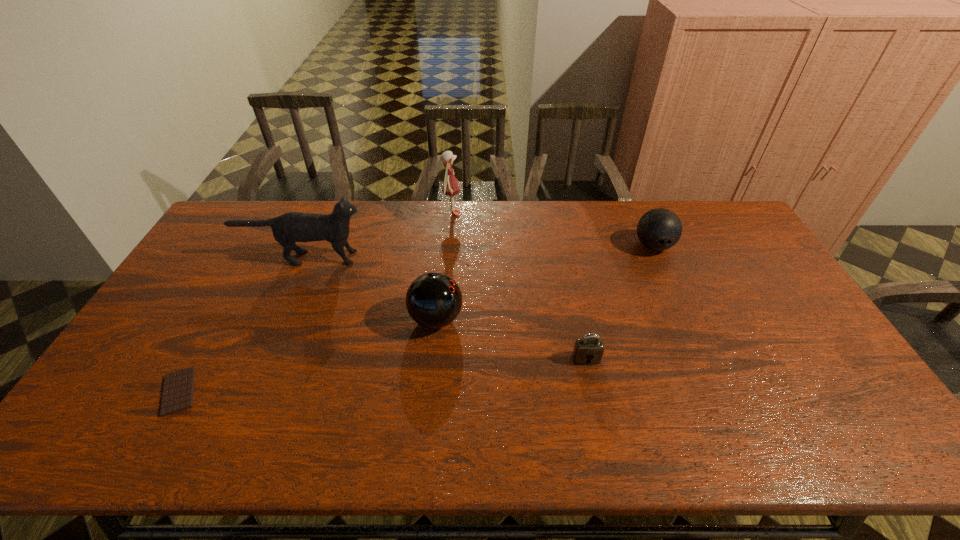
Where is `vacant space at the far edge of the desktop`? The height and width of the screenshot is (540, 960). vacant space at the far edge of the desktop is located at coordinates (502, 207).

Locate an element on the screen. This screenshot has width=960, height=540. free region at the near edge of the desktop is located at coordinates (245, 425).

The width and height of the screenshot is (960, 540). In the image, there is a desktop. Find the location of `vacant region at the left edge`. vacant region at the left edge is located at coordinates (180, 330).

What are the coordinates of `vacant space at the far left corner of the desktop` in the screenshot? It's located at (246, 209).

In the image, there is a desktop. What are the coordinates of `vacant space at the near left corner` in the screenshot? It's located at (87, 427).

Where is `free space between the doll and the shortest object`? The height and width of the screenshot is (540, 960). free space between the doll and the shortest object is located at coordinates pos(316,302).

You are a GUI agent. You are given a task and a screenshot of the screen. Output one action in this format:
    pyautogui.click(x=<x>, y=<y>)
    Task: Click on the vacant point located between the second object from right to left and the third nearest object
    Image resolution: width=960 pixels, height=540 pixels.
    Given the screenshot: What is the action you would take?
    pyautogui.click(x=511, y=339)

You are a GUI agent. You are given a task and a screenshot of the screen. Output one action in this format:
    pyautogui.click(x=<x>, y=<y>)
    Task: Click on the unoccupied position between the doll and the nearer bowling ball
    This screenshot has height=540, width=960.
    Given the screenshot: What is the action you would take?
    pyautogui.click(x=444, y=266)

Where is `free spot between the nearer bowling ball and the right bowling ball`? Image resolution: width=960 pixels, height=540 pixels. free spot between the nearer bowling ball and the right bowling ball is located at coordinates (544, 282).

You are a GUI agent. You are given a task and a screenshot of the screen. Output one action in this format:
    pyautogui.click(x=<x>, y=<y>)
    Task: Click on the free spot between the cat and the farthest object
    
    Given the screenshot: What is the action you would take?
    pyautogui.click(x=378, y=235)